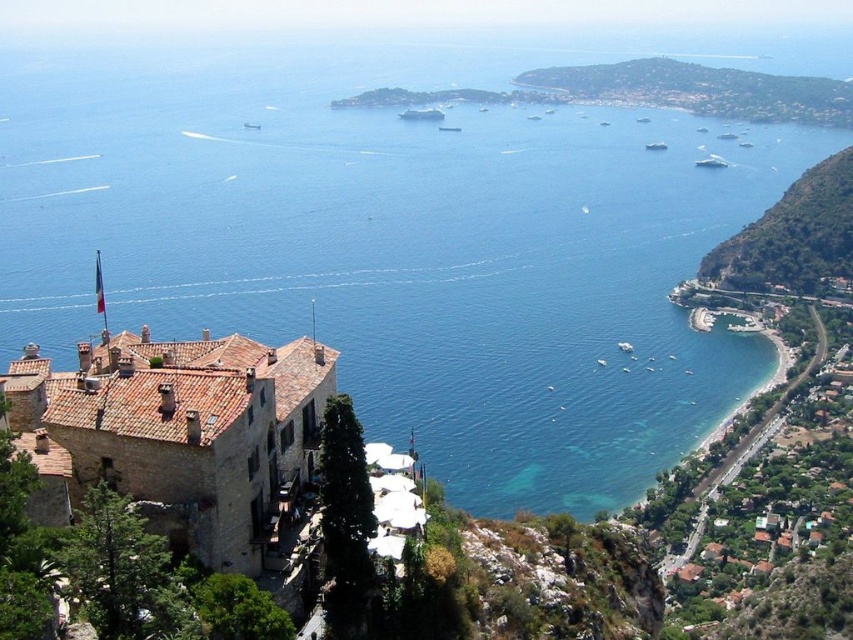
Can you confirm if green grassy hillside at upper right is bigger than green leafy hillside at right?

Yes, green grassy hillside at upper right is bigger than green leafy hillside at right.

Which is behind, point (843, 90) or point (769, 221)?

The point (843, 90) is more distant.

Does point (804, 115) come behind point (804, 257)?

Yes, it is behind point (804, 257).

Where is `green grassy hillside at upper right`? This screenshot has width=853, height=640. green grassy hillside at upper right is located at coordinates (701, 90).

Is white glossy ship at center below white glossy boat at center-right?

No.

Is white glossy ship at center further to the viewer compared to white glossy boat at center-right?

No, white glossy ship at center is closer to the viewer.

Does point (407, 113) come in front of point (648, 148)?

Yes, point (407, 113) is closer to viewer.

Image resolution: width=853 pixels, height=640 pixels. Identify the location of white glossy ship at center. pyautogui.click(x=422, y=115).

Does green grassy hillside at upper right have a lesser height compared to metallic silver boat at center?

Incorrect, green grassy hillside at upper right's height does not fall short of metallic silver boat at center's.

Does green grassy hillside at upper right have a greater width compared to metallic silver boat at center?

Indeed, green grassy hillside at upper right has a greater width compared to metallic silver boat at center.

Find the location of a particular element. The image size is (853, 640). green grassy hillside at upper right is located at coordinates (701, 90).

This screenshot has width=853, height=640. In order to click on green grassy hillside at upper right in this screenshot , I will do `click(701, 90)`.